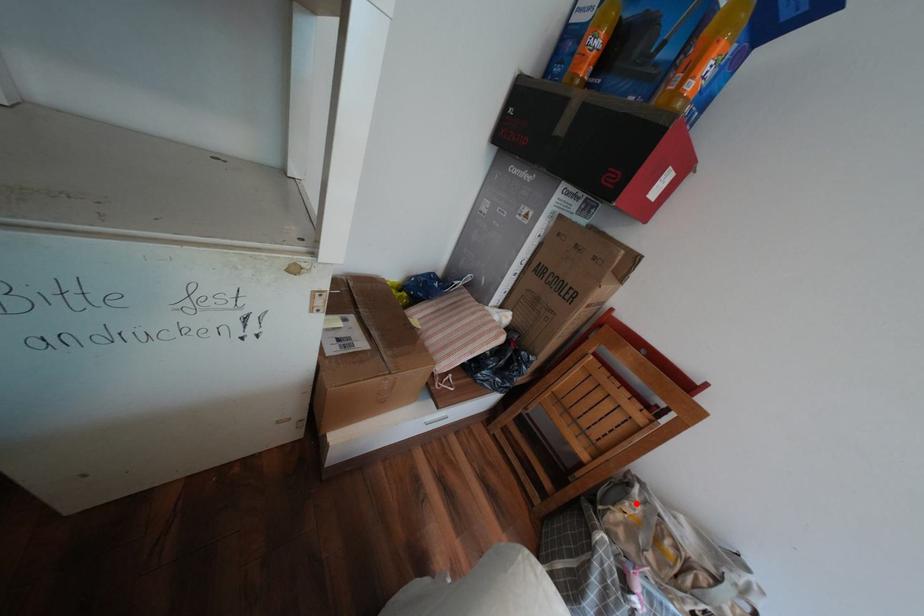
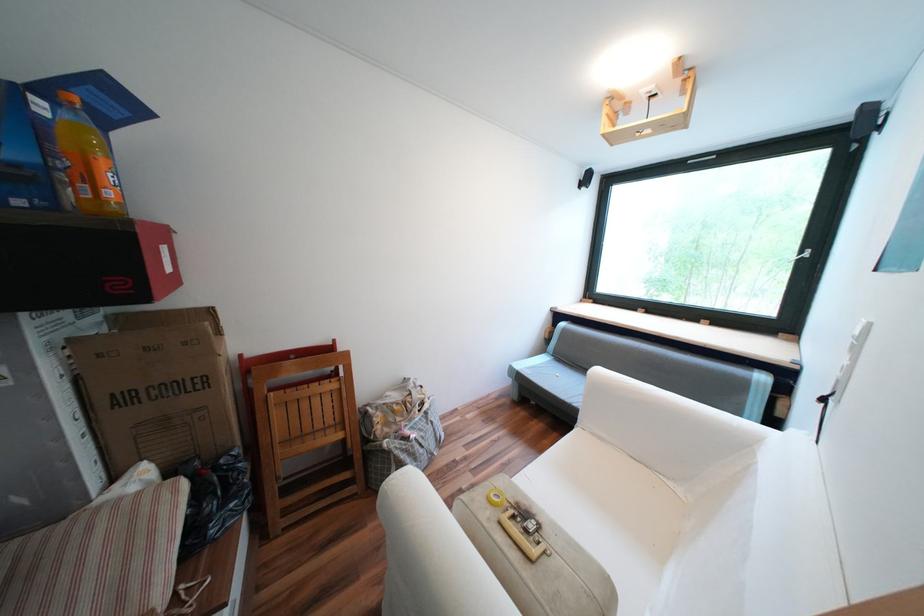
Where in the second image is the point corresponding to the highlighted location from the first image?

(383, 419)